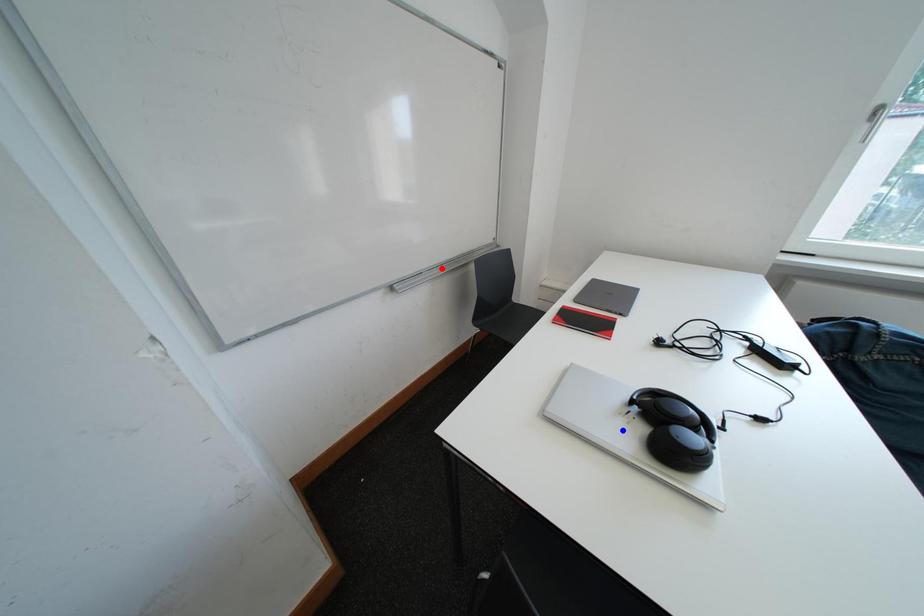
Question: In the image, two points are highlighted. Which point is nearer to the camera? Reply with the corresponding letter.

Choices:
 (A) blue point
 (B) red point

Answer: (A)